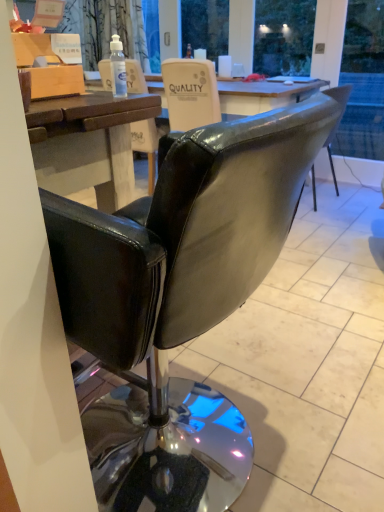
Question: Is transparent plastic bottle at upper center spatially inside wooden box at upper left, or outside of it?

Choices:
 (A) outside
 (B) inside

Answer: (A)

Question: Considering their positions, is transparent plastic bottle at upper center located in front of or behind wooden box at upper left?

Choices:
 (A) behind
 (B) front

Answer: (A)

Question: Estimate the real-world distances between objects in this image. Which object is closer to the wooden box at upper left?

Choices:
 (A) black leather chair at center
 (B) transparent plastic bottle at upper center

Answer: (B)

Question: Based on their relative distances, which object is farther from the black leather chair at center?

Choices:
 (A) wooden box at upper left
 (B) transparent plastic bottle at upper center

Answer: (B)